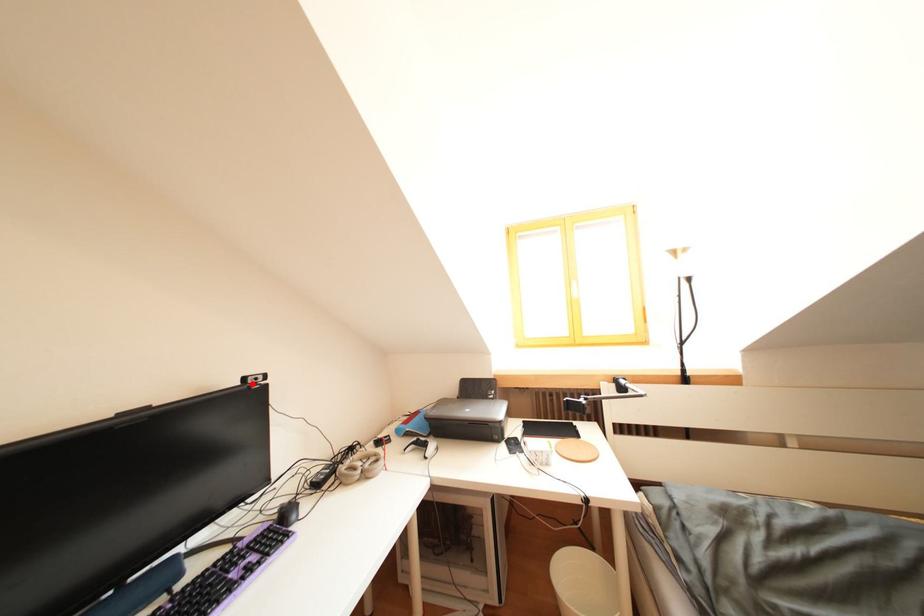
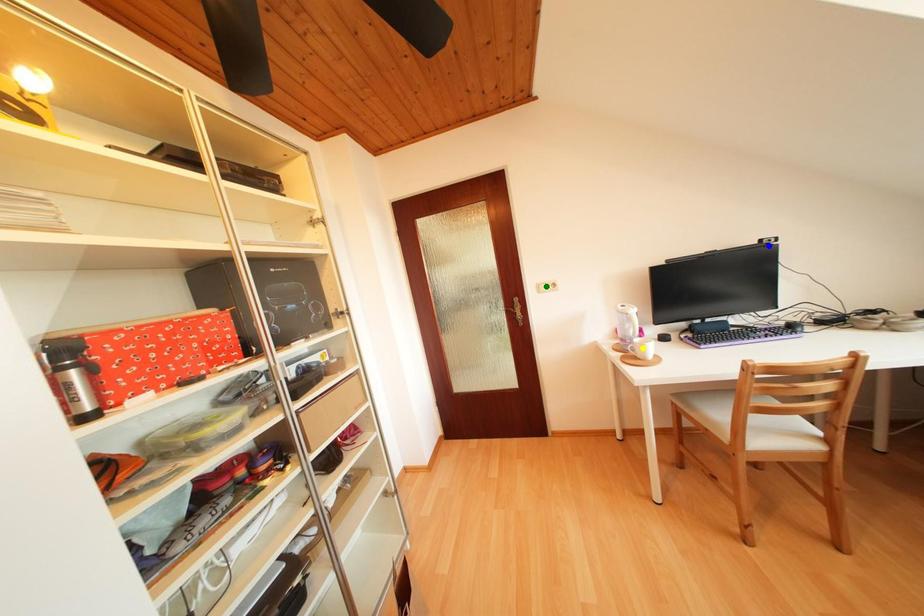
Question: I am providing you with two images of the same scene from different viewpoints. A red point is marked on the first image. You are given multiple points on the second image. Which point in image 2 represents the same 3d spot as the red point in image 1?

Choices:
 (A) blue point
 (B) green point
 (C) yellow point

Answer: (A)